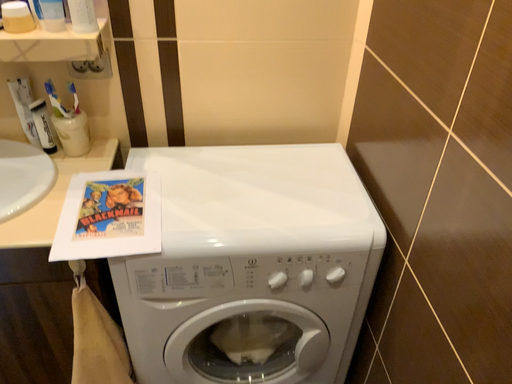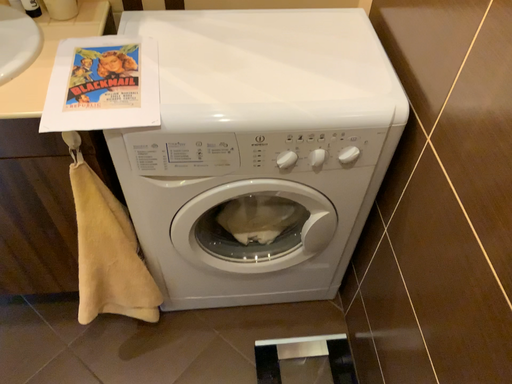
Question: How did the camera likely rotate when shooting the video?

Choices:
 (A) rotated upward
 (B) rotated downward

Answer: (B)